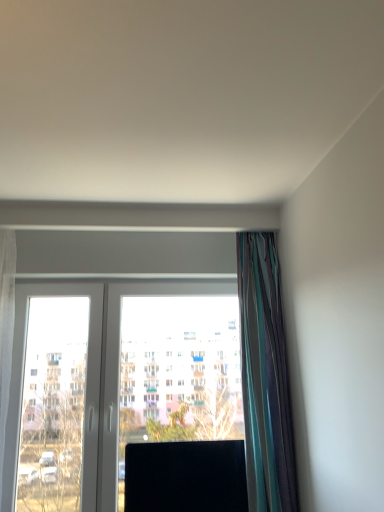
Question: Are black glossy screen at center and transparent glass window at center far apart?

Choices:
 (A) no
 (B) yes

Answer: (A)

Question: Can you confirm if black glossy screen at center is thinner than transparent glass window at center?

Choices:
 (A) no
 (B) yes

Answer: (A)

Question: From the image's perspective, is black glossy screen at center below transparent glass window at center?

Choices:
 (A) no
 (B) yes

Answer: (B)

Question: Can you confirm if black glossy screen at center is shorter than transparent glass window at center?

Choices:
 (A) yes
 (B) no

Answer: (A)

Question: Can you confirm if black glossy screen at center is positioned to the right of transparent glass window at center?

Choices:
 (A) no
 (B) yes

Answer: (B)

Question: Is black glossy screen at center positioned in front of transparent glass window at center?

Choices:
 (A) no
 (B) yes

Answer: (B)

Question: Would you say multicolored silky curtain at right is outside transparent glass window at center?

Choices:
 (A) yes
 (B) no

Answer: (A)

Question: From a real-world perspective, is multicolored silky curtain at right on top of transparent glass window at center?

Choices:
 (A) yes
 (B) no

Answer: (A)

Question: Is multicolored silky curtain at right not close to transparent glass window at center?

Choices:
 (A) yes
 (B) no

Answer: (B)

Question: Is multicolored silky curtain at right positioned with its back to transparent glass window at center?

Choices:
 (A) no
 (B) yes

Answer: (A)

Question: Is multicolored silky curtain at right further to camera compared to transparent glass window at center?

Choices:
 (A) no
 (B) yes

Answer: (A)

Question: Considering the relative positions of multicolored silky curtain at right and transparent glass window at center in the image provided, is multicolored silky curtain at right to the right of transparent glass window at center from the viewer's perspective?

Choices:
 (A) yes
 (B) no

Answer: (A)

Question: Can you confirm if multicolored silky curtain at right is positioned to the left of black glossy screen at center?

Choices:
 (A) no
 (B) yes

Answer: (A)